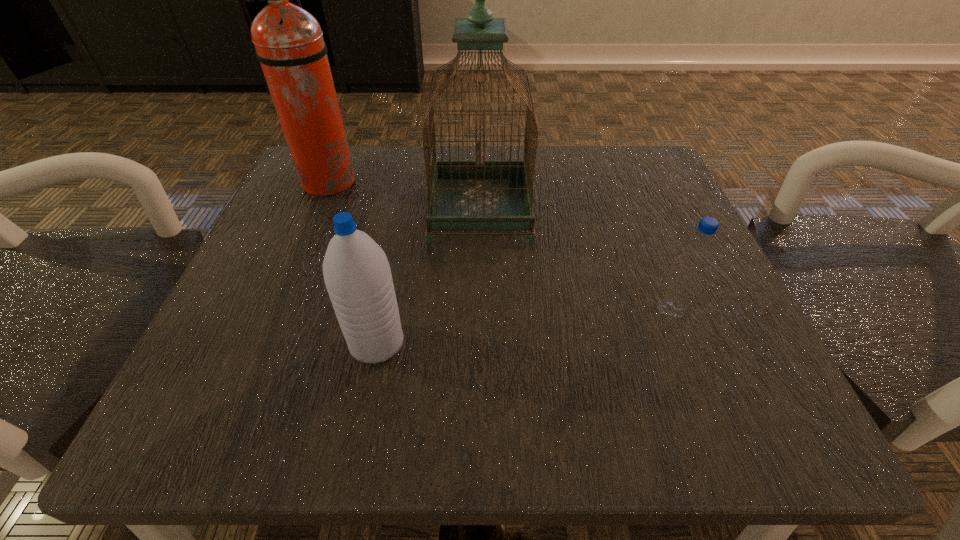
This screenshot has height=540, width=960. Find the location of `fire extinguisher that is at the far edge`. fire extinguisher that is at the far edge is located at coordinates (289, 43).

This screenshot has width=960, height=540. In order to click on birdcage present at the far edge in this screenshot , I will do `click(463, 195)`.

Where is `object that is at the left edge`? The width and height of the screenshot is (960, 540). object that is at the left edge is located at coordinates (289, 43).

Image resolution: width=960 pixels, height=540 pixels. Find the location of `object that is at the right edge`. object that is at the right edge is located at coordinates (696, 252).

Identify the location of object located at the far left corner. (289, 43).

In the image, there is a desktop. At what (x,y) coordinates should I click in order to perform the action: click on vacant space at the far edge. Please return your answer as a coordinate pair (x, y). This screenshot has height=540, width=960. Looking at the image, I should click on (540, 161).

You are a GUI agent. You are given a task and a screenshot of the screen. Output one action in this format:
    pyautogui.click(x=<x>, y=<y>)
    Task: Click on the vacant region at the near edge of the desktop
    This screenshot has height=540, width=960.
    Given the screenshot: What is the action you would take?
    pyautogui.click(x=339, y=378)

Find the location of a particular element. Image resolution: width=960 pixels, height=540 pixels. vacant area at the left edge of the desktop is located at coordinates (310, 372).

Find the location of a particular element. This screenshot has height=540, width=960. vacant space at the right edge of the desktop is located at coordinates (704, 353).

Image resolution: width=960 pixels, height=540 pixels. In order to click on vacant space at the far left corner in this screenshot , I will do `click(337, 200)`.